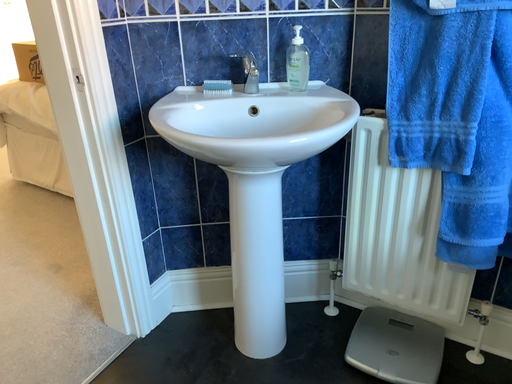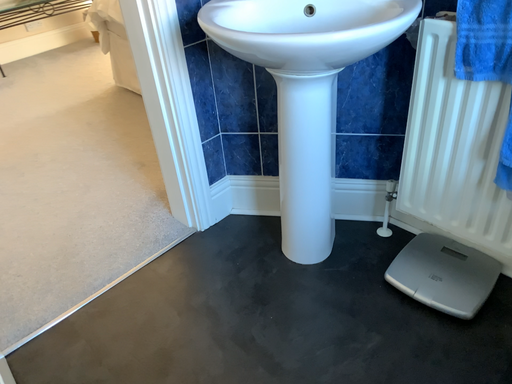
Question: How did the camera likely rotate when shooting the video?

Choices:
 (A) rotated left
 (B) rotated right

Answer: (A)